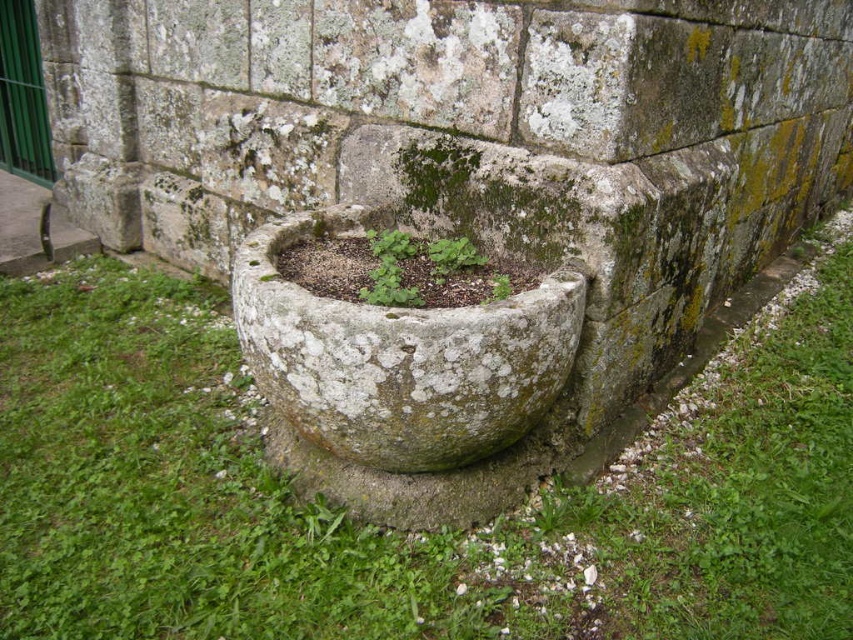
Question: Is the position of green mossy stone at center less distant than that of green mossy plant at center?

Choices:
 (A) yes
 (B) no

Answer: (A)

Question: Which point is farther to the camera?

Choices:
 (A) [791, 321]
 (B) [415, 296]

Answer: (A)

Question: Can you confirm if green mossy stone at center is positioned to the left of green mossy plant at center?

Choices:
 (A) no
 (B) yes

Answer: (B)

Question: Can you confirm if green mossy stone at center is positioned above green mossy plant at center?

Choices:
 (A) no
 (B) yes

Answer: (A)